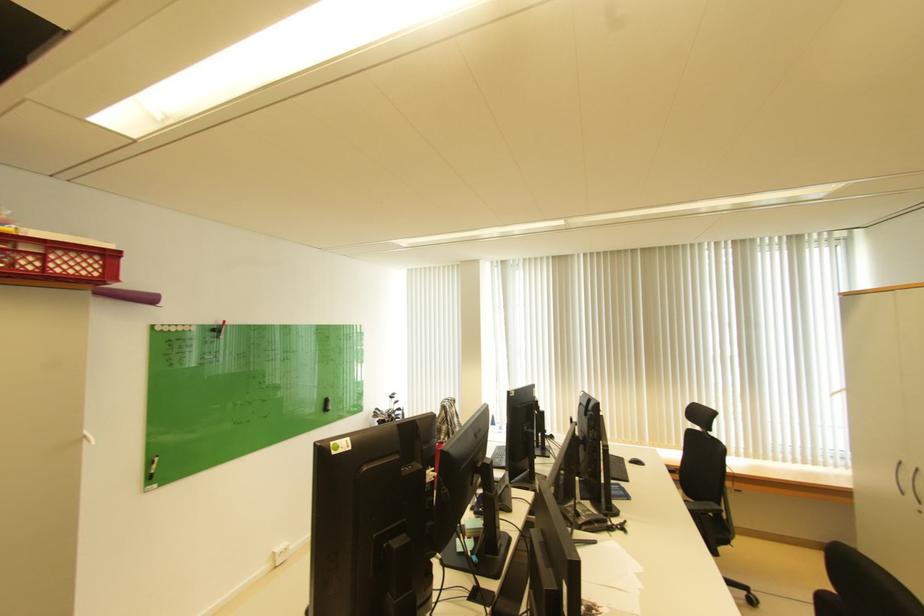
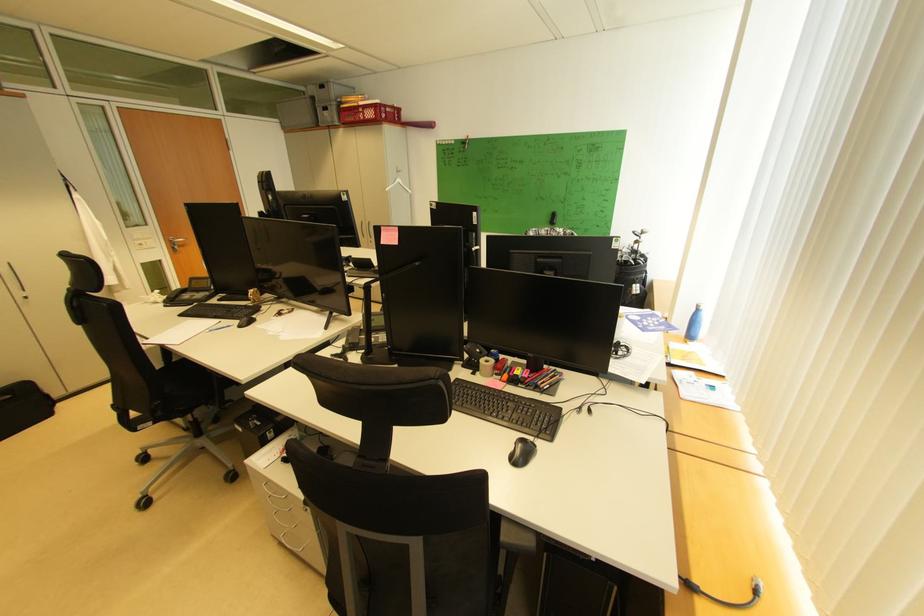
Where in the second image is the point corresponding to (x=54, y=268) from the first image?

(372, 118)